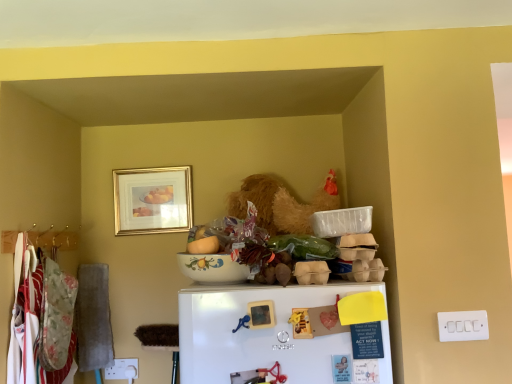
Describe the element at coordinates (212, 268) in the screenshot. I see `porcelain floral bowl at center` at that location.

What do you see at coordinates (463, 326) in the screenshot? I see `white plastic switch at lower right` at bounding box center [463, 326].

This screenshot has width=512, height=384. Describe the element at coordinates (204, 246) in the screenshot. I see `matte ceramic bowl at center` at that location.

Image resolution: width=512 pixels, height=384 pixels. What are the coordinates of `matte ceramic bowl at center` in the screenshot? It's located at (204, 246).

Where is `porcelain floral bowl at center`? Image resolution: width=512 pixels, height=384 pixels. porcelain floral bowl at center is located at coordinates (212, 268).

Is gold/glass picture frame at upper center oriented towards metallic hanger at left?

No, gold/glass picture frame at upper center does not turn towards metallic hanger at left.

Consider the image. Does gold/glass picture frame at upper center appear on the left side of metallic hanger at left?

No, gold/glass picture frame at upper center is not to the left of metallic hanger at left.

Consider the image. Can you confirm if gold/glass picture frame at upper center is smaller than metallic hanger at left?

Actually, gold/glass picture frame at upper center might be larger than metallic hanger at left.

Which object is closer to the camera taking this photo, gold/glass picture frame at upper center or metallic hanger at left?

metallic hanger at left is more forward.

Is matte ceramic bowl at center wider than white plastic switch at lower right?

Yes, matte ceramic bowl at center is wider than white plastic switch at lower right.

Is matte ceramic bowl at center far from white plastic switch at lower right?

No, matte ceramic bowl at center is not far away from white plastic switch at lower right.

Which is more to the left, matte ceramic bowl at center or white plastic switch at lower right?

From the viewer's perspective, matte ceramic bowl at center appears more on the left side.

Is the position of white plastic switch at lower right more distant than that of gold/glass picture frame at upper center?

No, white plastic switch at lower right is in front of gold/glass picture frame at upper center.

I want to click on electric outlet on the right of gold/glass picture frame at upper center, so click(463, 326).

Between white plastic switch at lower right and gold/glass picture frame at upper center, which one has larger width?

Wider between the two is gold/glass picture frame at upper center.

In the scene shown: Considering the sizes of objects white plastic switch at lower right and gold/glass picture frame at upper center in the image provided, who is bigger, white plastic switch at lower right or gold/glass picture frame at upper center?

gold/glass picture frame at upper center is bigger.

What's the angular difference between white matte refrigerator at lower center and metallic hanger at left's facing directions?

The facing directions of white matte refrigerator at lower center and metallic hanger at left are 91.8 degrees apart.

Can you confirm if white matte refrigerator at lower center is shorter than metallic hanger at left?

Incorrect, the height of white matte refrigerator at lower center does not fall short of that of metallic hanger at left.

From the image's perspective, does white matte refrigerator at lower center appear lower than metallic hanger at left?

Yes.

Considering the relative sizes of white matte refrigerator at lower center and metallic hanger at left in the image provided, is white matte refrigerator at lower center thinner than metallic hanger at left?

Incorrect, the width of white matte refrigerator at lower center is not less than that of metallic hanger at left.

The height and width of the screenshot is (384, 512). I want to click on food above the porcelain floral bowl at center (from the image's perspective), so click(x=204, y=246).

Which is closer to the camera, [217,245] or [213,267]?

Point [217,245] is farther from the camera than point [213,267].

Looking at this image, between matte ceramic bowl at center and porcelain floral bowl at center, which one has more height?

porcelain floral bowl at center is taller.

Based on the photo, is matte ceramic bowl at center positioned with its back to porcelain floral bowl at center?

Yes.

Who is bigger, gold/glass picture frame at upper center or floral fabric laundry at left?

floral fabric laundry at left is bigger.

Visually, is gold/glass picture frame at upper center positioned to the left or to the right of floral fabric laundry at left?

gold/glass picture frame at upper center is to the right of floral fabric laundry at left.

Are gold/glass picture frame at upper center and floral fabric laundry at left located far from each other?

gold/glass picture frame at upper center is near floral fabric laundry at left, not far away.

Is gold/glass picture frame at upper center in front of or behind floral fabric laundry at left in the image?

gold/glass picture frame at upper center is positioned farther from the viewer than floral fabric laundry at left.

Looking at this image, can we say gold/glass picture frame at upper center lies outside porcelain floral bowl at center?

Yes.

From the image's perspective, which is below, gold/glass picture frame at upper center or porcelain floral bowl at center?

porcelain floral bowl at center is shown below in the image.

Considering the relative positions of gold/glass picture frame at upper center and porcelain floral bowl at center in the image provided, is gold/glass picture frame at upper center behind porcelain floral bowl at center?

Yes, gold/glass picture frame at upper center is further from the camera.

Identify the location of hanger lying below the gold/glass picture frame at upper center (from the image's perspective). click(x=54, y=239).

Locate an element on the screen. The height and width of the screenshot is (384, 512). food that is above the white plastic switch at lower right (from the image's perspective) is located at coordinates (204, 246).

Estimate the real-world distances between objects in this image. Which object is further from porcelain floral bowl at center, metallic hanger at left or gold/glass picture frame at upper center?

metallic hanger at left.

Which object lies further to the anchor point floral fabric laundry at left, gold/glass picture frame at upper center or white matte refrigerator at lower center?

white matte refrigerator at lower center is positioned further to the anchor floral fabric laundry at left.

Looking at the image, which one is located closer to white matte refrigerator at lower center, porcelain floral bowl at center or floral fabric laundry at left?

porcelain floral bowl at center is positioned closer to the anchor white matte refrigerator at lower center.

Looking at the image, which one is located closer to gold/glass picture frame at upper center, white matte refrigerator at lower center or matte ceramic bowl at center?

Based on the image, matte ceramic bowl at center appears to be nearer to gold/glass picture frame at upper center.

Estimate the real-world distances between objects in this image. Which object is closer to metallic hanger at left, white matte refrigerator at lower center or porcelain floral bowl at center?

porcelain floral bowl at center lies closer to metallic hanger at left than the other object.

Based on the photo, looking at the image, which one is located further to floral fabric laundry at left, matte ceramic bowl at center or porcelain floral bowl at center?

matte ceramic bowl at center lies further to floral fabric laundry at left than the other object.

Based on their spatial positions, is metallic hanger at left or gold/glass picture frame at upper center further from matte ceramic bowl at center?

gold/glass picture frame at upper center is positioned further to the anchor matte ceramic bowl at center.

From the image, which object appears to be farther from metallic hanger at left, floral fabric laundry at left or white plastic switch at lower right?

The object further to metallic hanger at left is white plastic switch at lower right.

Find the location of a particular element. The image size is (512, 384). refrigerator between matte ceramic bowl at center and white plastic switch at lower right in the horizontal direction is located at coordinates (258, 332).

Locate an element on the screen. Image resolution: width=512 pixels, height=384 pixels. laundry located between matte ceramic bowl at center and gold/glass picture frame at upper center in the depth direction is located at coordinates (31, 323).

Identify the location of picture frame between metallic hanger at left and white matte refrigerator at lower center in the horizontal direction. This screenshot has height=384, width=512. (153, 200).

In order to click on laundry located between metallic hanger at left and white matte refrigerator at lower center in the left-right direction in this screenshot , I will do `click(31, 323)`.